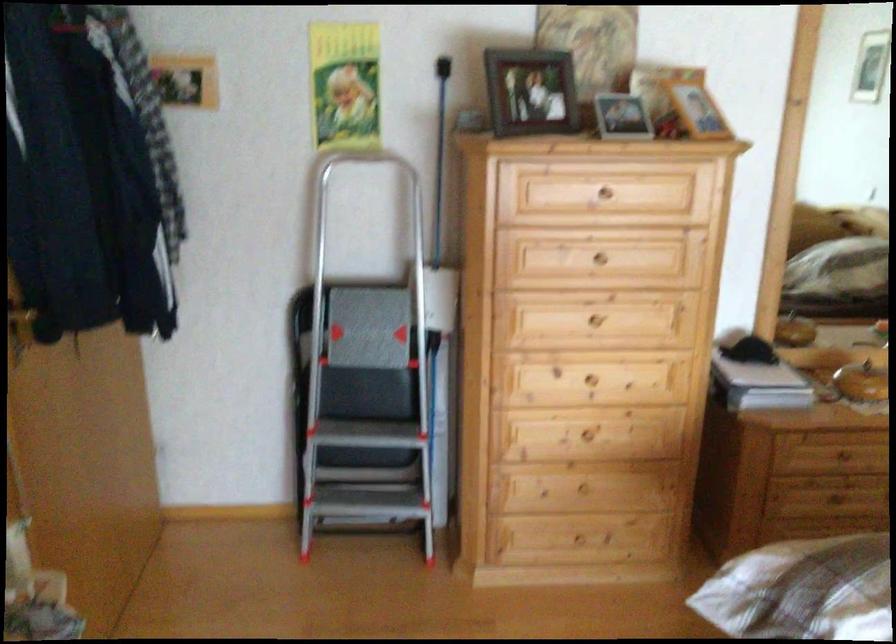
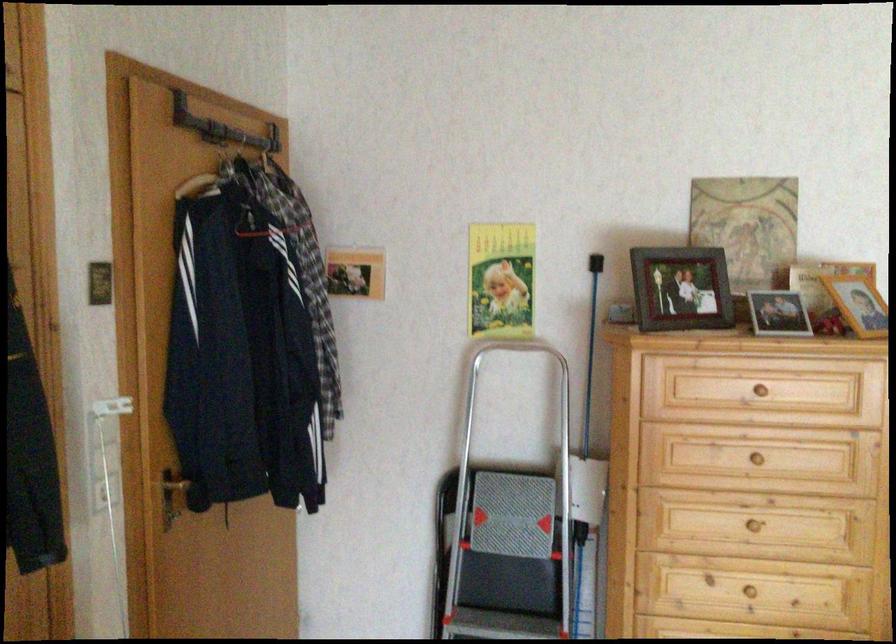
The point at [528,98] is marked in the first image. Where is the corresponding point in the second image?

(681, 289)